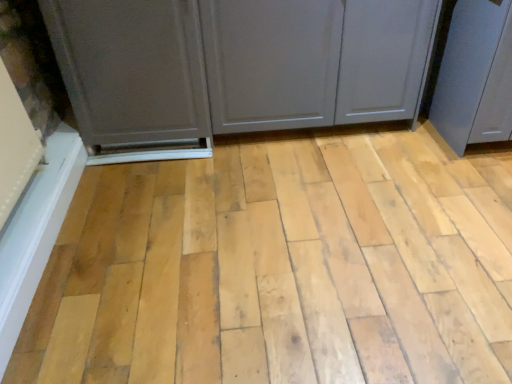
You are a GUI agent. You are given a task and a screenshot of the screen. Output one action in this format:
    pyautogui.click(x=<x>, y=<y>)
    Task: Click on the free spot in front of matte gray cabinet at left, which appears as the second screen door when viewed from the right
    
    Given the screenshot: What is the action you would take?
    pyautogui.click(x=159, y=195)